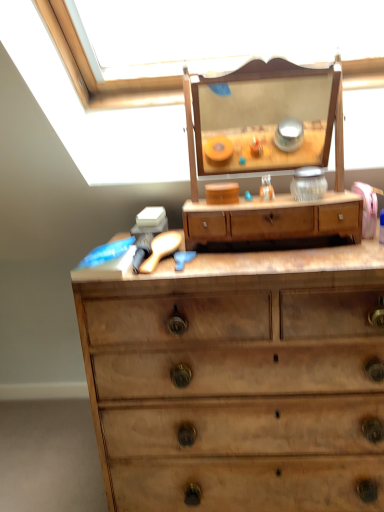
Question: Is wooden chest of drawers at center not inside wooden drawer at center?

Choices:
 (A) no
 (B) yes

Answer: (B)

Question: Is wooden chest of drawers at center far away from wooden drawer at center?

Choices:
 (A) no
 (B) yes

Answer: (A)

Question: Considering the relative positions of wooden chest of drawers at center and wooden drawer at center in the image provided, is wooden chest of drawers at center to the right of wooden drawer at center from the viewer's perspective?

Choices:
 (A) yes
 (B) no

Answer: (A)

Question: Is the depth of wooden chest of drawers at center greater than that of wooden drawer at center?

Choices:
 (A) no
 (B) yes

Answer: (A)

Question: Would you say wooden drawer at center is part of wooden chest of drawers at center's contents?

Choices:
 (A) yes
 (B) no

Answer: (B)

Question: Is wooden chest of drawers at center shorter than wooden drawer at center?

Choices:
 (A) yes
 (B) no

Answer: (B)

Question: Is wooden drawer at center shorter than wooden chest of drawers at center?

Choices:
 (A) no
 (B) yes

Answer: (B)

Question: Can you confirm if wooden drawer at center is positioned to the left of wooden chest of drawers at center?

Choices:
 (A) yes
 (B) no

Answer: (A)

Question: Does wooden drawer at center touch wooden chest of drawers at center?

Choices:
 (A) yes
 (B) no

Answer: (B)

Question: Is wooden drawer at center turned away from wooden chest of drawers at center?

Choices:
 (A) yes
 (B) no

Answer: (B)

Question: Is wooden drawer at center at the right side of wooden chest of drawers at center?

Choices:
 (A) yes
 (B) no

Answer: (B)

Question: Is wooden drawer at center not within wooden chest of drawers at center?

Choices:
 (A) yes
 (B) no

Answer: (A)

Question: Considering the relative positions of wooden drawer at center and wooden chest of drawers at center in the image provided, is wooden drawer at center to the left or to the right of wooden chest of drawers at center?

Choices:
 (A) left
 (B) right

Answer: (A)